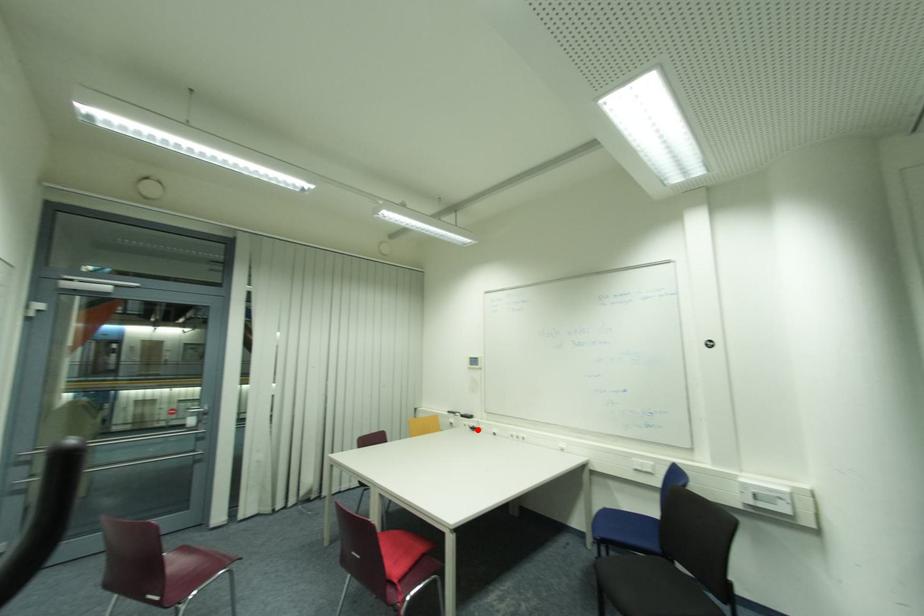
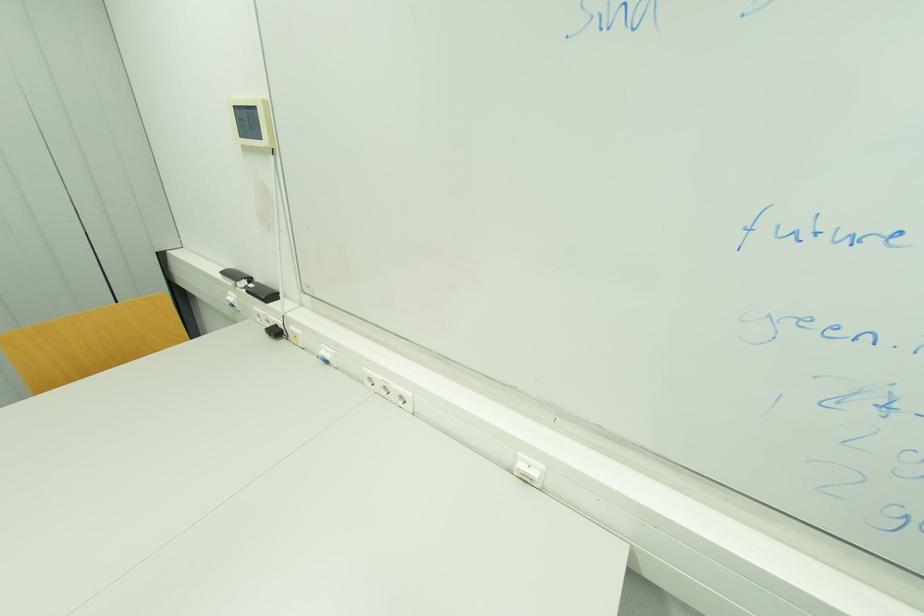
Where in the second image is the point corresponding to the highlighted location from the first image?

(281, 333)